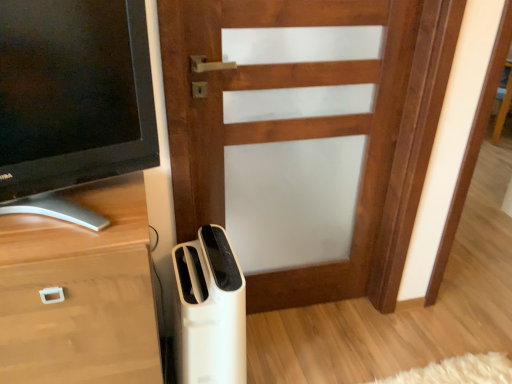
Image resolution: width=512 pixels, height=384 pixels. Find the location of `white plastic air purifier at lower center`. white plastic air purifier at lower center is located at coordinates (209, 310).

Where is `wooden chest of drawers at lower left`? The height and width of the screenshot is (384, 512). wooden chest of drawers at lower left is located at coordinates (80, 293).

The width and height of the screenshot is (512, 384). What do you see at coordinates (282, 122) in the screenshot? I see `wooden door at center` at bounding box center [282, 122].

Where is `matte black tv at left`? matte black tv at left is located at coordinates pyautogui.click(x=72, y=101).

Is wooden chest of drawers at lower left positioned beyond the bounds of matte black tv at left?

Yes, wooden chest of drawers at lower left is located beyond the bounds of matte black tv at left.

Between wooden chest of drawers at lower left and matte black tv at left, which one has larger size?

wooden chest of drawers at lower left is bigger.

From the image's perspective, is wooden chest of drawers at lower left on matte black tv at left?

No.

Is matte black tv at left at the back of wooden chest of drawers at lower left?

No, matte black tv at left is not at the back of wooden chest of drawers at lower left.

Based on their sizes in the image, would you say wooden door at center is bigger or smaller than matte black tv at left?

Considering their sizes, wooden door at center takes up more space than matte black tv at left.

From a real-world perspective, which object stands above the other?

In real-world perspective, matte black tv at left is above.

Find the location of a particular element. This screenshot has width=512, height=384. television on the left of wooden door at center is located at coordinates (72, 101).

Does wooden door at center turn towards white plastic air purifier at lower center?

No, wooden door at center is not facing towards white plastic air purifier at lower center.

Considering the positions of points (372, 221) and (177, 329), is point (372, 221) closer to camera compared to point (177, 329)?

No, it is not.

Considering the positions of objects wooden door at center and white plastic air purifier at lower center in the image provided, who is more to the left, wooden door at center or white plastic air purifier at lower center?

Positioned to the left is white plastic air purifier at lower center.

At what (x,y) coordinates should I click in order to perform the action: click on the chest of drawers that appears in front of the wooden door at center. Please return your answer as a coordinate pair (x, y). The width and height of the screenshot is (512, 384). Looking at the image, I should click on (80, 293).

From the picture: Is wooden chest of drawers at lower left thinner than wooden door at center?

Indeed, wooden chest of drawers at lower left has a lesser width compared to wooden door at center.

Is wooden chest of drawers at lower left not close to wooden door at center?

No, there isn't a large distance between wooden chest of drawers at lower left and wooden door at center.

Is wooden chest of drawers at lower left turned away from wooden door at center?

wooden chest of drawers at lower left is not turned away from wooden door at center.

Is wooden door at center oriented towards wooden chest of drawers at lower left?

No, wooden door at center is not turned towards wooden chest of drawers at lower left.

Is wooden door at center taller or shorter than wooden chest of drawers at lower left?

wooden door at center is taller than wooden chest of drawers at lower left.

Can you tell me how much wooden door at center and wooden chest of drawers at lower left differ in facing direction?

91.4 degrees.

Can we say wooden door at center lies outside wooden chest of drawers at lower left?

Yes, wooden door at center is located beyond the bounds of wooden chest of drawers at lower left.

Can you see white plastic air purifier at lower center touching wooden chest of drawers at lower left?

No.

Where is `home appliance that appears behind the wooden chest of drawers at lower left`? This screenshot has height=384, width=512. home appliance that appears behind the wooden chest of drawers at lower left is located at coordinates (209, 310).

Is point (210, 304) positioned in front of point (94, 250)?

No, it is behind (94, 250).

Which object is positioned more to the left, white plastic air purifier at lower center or matte black tv at left?

matte black tv at left is more to the left.

Is white plastic air purifier at lower center next to matte black tv at left?

No, white plastic air purifier at lower center is not touching matte black tv at left.

Is white plastic air purifier at lower center positioned beyond the bounds of matte black tv at left?

white plastic air purifier at lower center is positioned outside matte black tv at left.

Between white plastic air purifier at lower center and matte black tv at left, which one has larger width?

white plastic air purifier at lower center.

Identify the location of television above the wooden chest of drawers at lower left (from the image's perspective). (72, 101).

What are the coordinates of `television lying on the left of wooden door at center` in the screenshot? It's located at (72, 101).

Based on the photo, considering their positions, is matte black tv at left positioned closer to wooden chest of drawers at lower left than wooden door at center?

matte black tv at left lies closer to wooden chest of drawers at lower left than the other object.

Estimate the real-world distances between objects in this image. Which object is further from matte black tv at left, white plastic air purifier at lower center or wooden chest of drawers at lower left?

white plastic air purifier at lower center.

Looking at the image, which one is located further to matte black tv at left, wooden chest of drawers at lower left or wooden door at center?

Based on the image, wooden door at center appears to be further to matte black tv at left.

Based on their spatial positions, is matte black tv at left or wooden door at center further from white plastic air purifier at lower center?

matte black tv at left is further to white plastic air purifier at lower center.

From the image, which object appears to be farther from wooden door at center, wooden chest of drawers at lower left or matte black tv at left?

wooden chest of drawers at lower left is further to wooden door at center.

Looking at the image, which one is located further to white plastic air purifier at lower center, wooden door at center or matte black tv at left?

The object further to white plastic air purifier at lower center is matte black tv at left.

Considering their positions, is wooden door at center positioned closer to wooden chest of drawers at lower left than white plastic air purifier at lower center?

The object closer to wooden chest of drawers at lower left is white plastic air purifier at lower center.

Estimate the real-world distances between objects in this image. Which object is closer to white plastic air purifier at lower center, wooden chest of drawers at lower left or wooden door at center?

wooden chest of drawers at lower left.

Identify the location of home appliance between wooden chest of drawers at lower left and wooden door at center in the horizontal direction. (209, 310).

This screenshot has width=512, height=384. What are the coordinates of `door between matte black tv at left and white plastic air purifier at lower center from top to bottom` in the screenshot? It's located at (282, 122).

Image resolution: width=512 pixels, height=384 pixels. Identify the location of the chest of drawers that lies between matte black tv at left and white plastic air purifier at lower center from top to bottom. (80, 293).

Identify the location of television between wooden chest of drawers at lower left and wooden door at center. (72, 101).